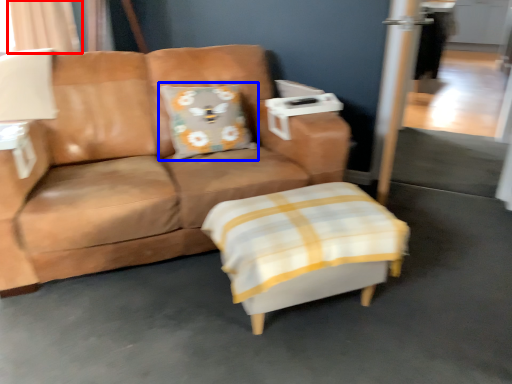
Question: Which object appears closest to the camera in this image, curtain (highlighted by a red box) or pillow (highlighted by a blue box)?

Choices:
 (A) curtain
 (B) pillow

Answer: (B)